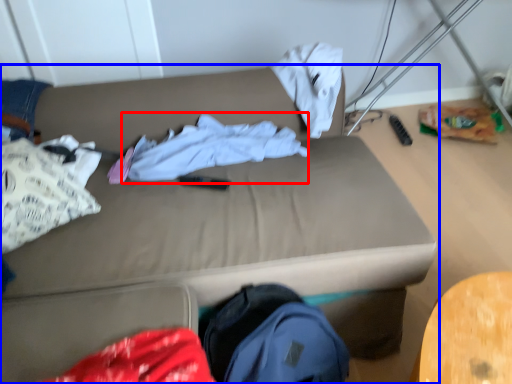
Question: Which object is further to the camera taking this photo, clothing (highlighted by a red box) or studio couch (highlighted by a blue box)?

Choices:
 (A) clothing
 (B) studio couch

Answer: (A)